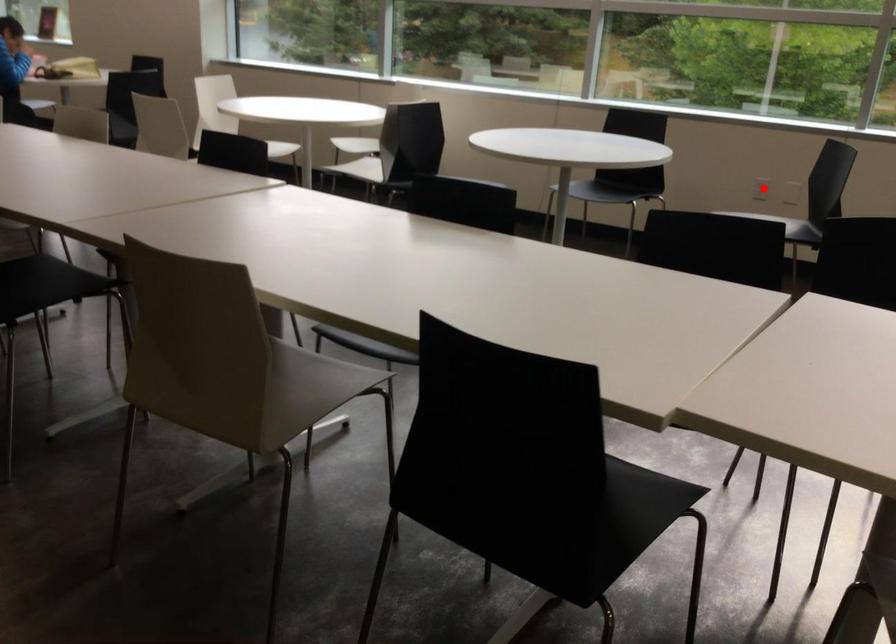
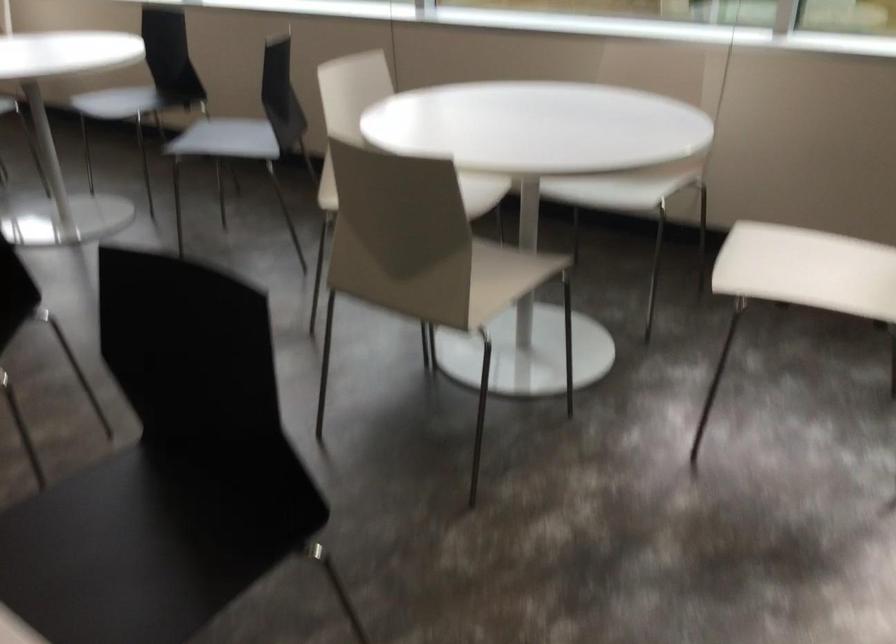
Question: I am providing you with two images of the same scene from different viewpoints. A red point is marked on the first image. Can you still see the location of the red point in image 2?

Choices:
 (A) Yes
 (B) No

Answer: (B)